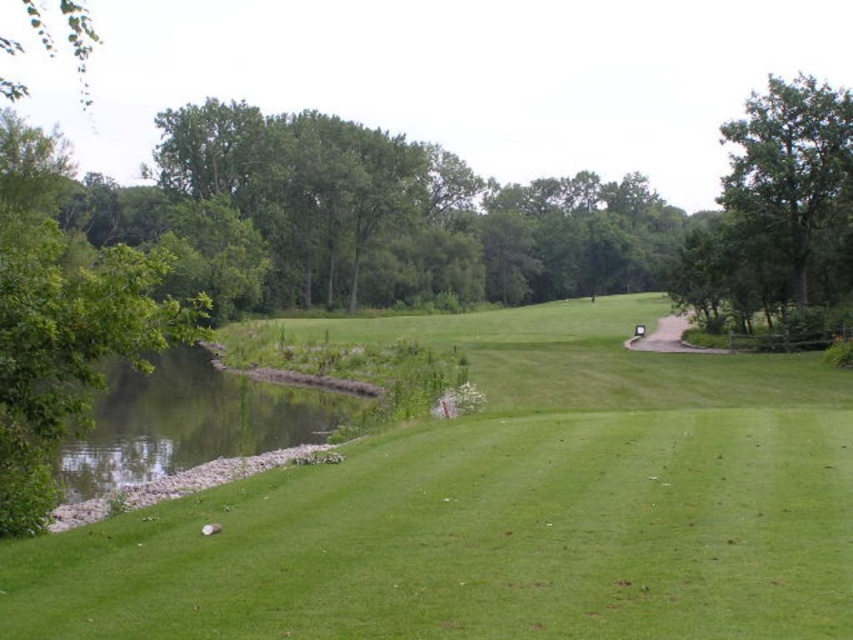
Question: Can you confirm if green grassy golf course at center is smaller than green leafy tree at upper left?

Choices:
 (A) yes
 (B) no

Answer: (A)

Question: Can you confirm if green grassy golf course at center is positioned to the right of green leafy tree at upper left?

Choices:
 (A) no
 (B) yes

Answer: (B)

Question: Which point is farther to the camera?

Choices:
 (A) (804, 269)
 (B) (4, 88)
 (C) (688, 557)

Answer: (B)

Question: Considering the relative positions of green grassy golf course at center and green leafy tree at upper left in the image provided, where is green grassy golf course at center located with respect to green leafy tree at upper left?

Choices:
 (A) below
 (B) above

Answer: (A)

Question: Which object appears farthest from the camera in this image?

Choices:
 (A) green grassy golf course at center
 (B) green leafy tree at upper left

Answer: (B)

Question: Which object is the farthest from the green leafy tree at upper left?

Choices:
 (A) green leafy tree at upper right
 (B) green grassy golf course at center

Answer: (A)